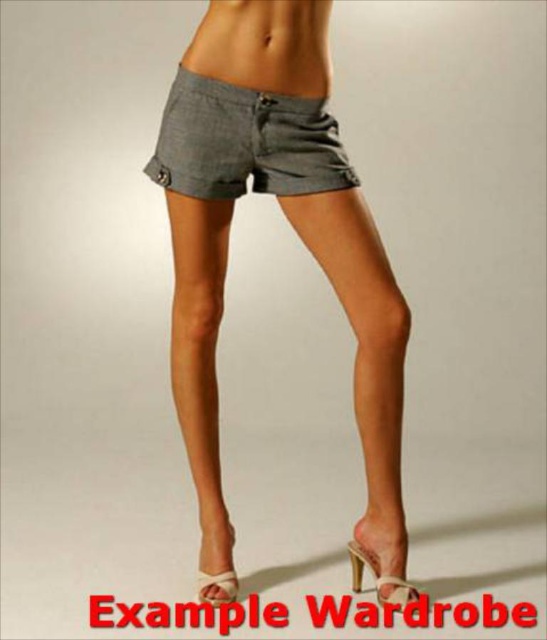
Which is above, matte gray shorts at center or gray cotton shorts at center?

Positioned higher is gray cotton shorts at center.

Between point (387, 374) and point (307, 99), which one is positioned in front?

Positioned in front is point (307, 99).

Is point (211, 547) positioned in front of point (183, 193)?

No, it is behind (183, 193).

Locate an element on the screen. Image resolution: width=547 pixels, height=640 pixels. matte gray shorts at center is located at coordinates (299, 237).